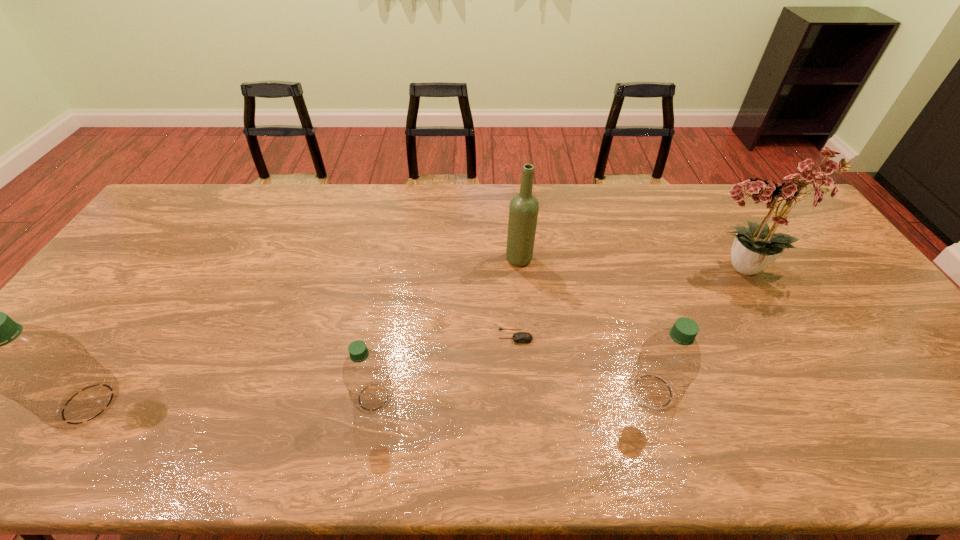
Locate an element on the screen. Image resolution: width=960 pixels, height=540 pixels. flower arrangement is located at coordinates (754, 248).

Locate an element on the screen. The width and height of the screenshot is (960, 540). vacant space located on the right of the leftmost object is located at coordinates (180, 403).

Identify the location of vacant space situated on the back of the shortest water bottle. (396, 271).

The image size is (960, 540). Identify the location of blank area located 0.310m on the left of the fifth object from left to right. (496, 391).

This screenshot has height=540, width=960. Identify the location of blank area located 0.240m on the back of the wine bottle. (515, 204).

Locate an element on the screen. This screenshot has width=960, height=540. vacant area situated 0.050m on the left of the mouse is located at coordinates (478, 336).

Where is `vacant space located 0.240m on the front-facing side of the flower arrangement`? vacant space located 0.240m on the front-facing side of the flower arrangement is located at coordinates (614, 270).

This screenshot has width=960, height=540. Find the location of `free space located on the front-facing side of the flower arrangement`. free space located on the front-facing side of the flower arrangement is located at coordinates (578, 270).

This screenshot has width=960, height=540. I want to click on free space located 0.090m on the front-facing side of the flower arrangement, so 664,270.

Locate an element on the screen. object located at the left edge is located at coordinates (48, 372).